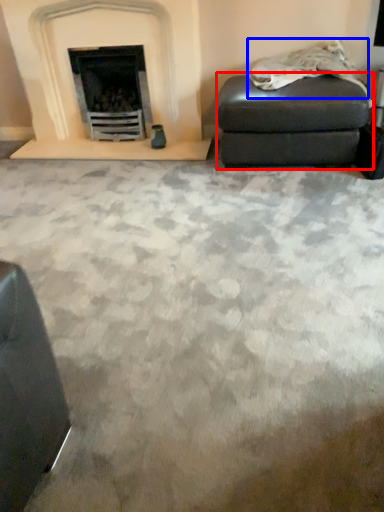
Question: Which of the following is the farthest to the observer, stool (highlighted by a red box) or material (highlighted by a blue box)?

Choices:
 (A) stool
 (B) material

Answer: (A)